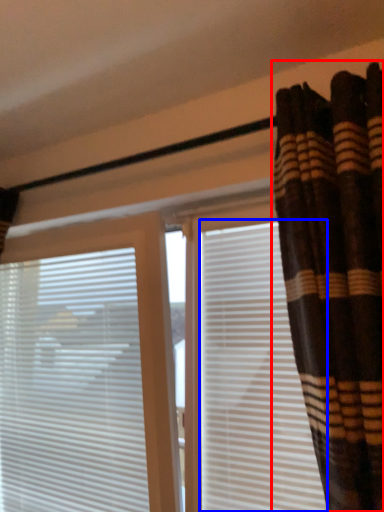
Question: Which point is closer to the camera, curtain (highlighted by a red box) or shutter (highlighted by a blue box)?

Choices:
 (A) curtain
 (B) shutter

Answer: (A)